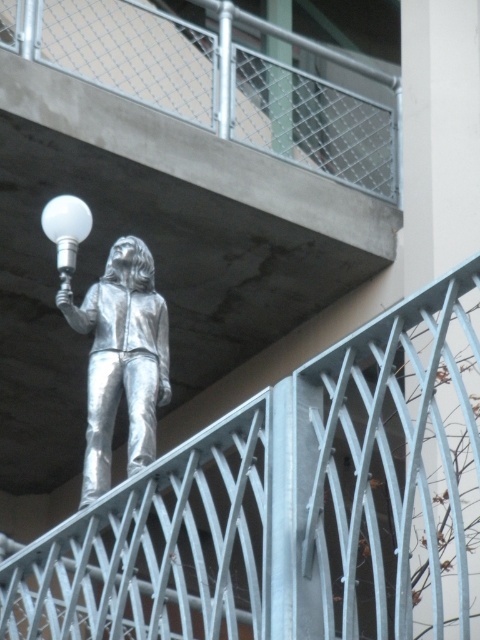
Is point (156, 22) behind point (121, 356)?

Yes, it is behind point (121, 356).

How much distance is there between brushed metal balcony at upper center and shiny silver figure at upper center?

They are 16.84 meters apart.

Locate an element on the screen. brushed metal balcony at upper center is located at coordinates (313, 115).

Between shiny silver figure at upper center and white glossy bulb at upper center, which one appears on the left side from the viewer's perspective?

white glossy bulb at upper center

What do you see at coordinates (121, 358) in the screenshot?
I see `shiny silver figure at upper center` at bounding box center [121, 358].

The height and width of the screenshot is (640, 480). What do you see at coordinates (121, 358) in the screenshot?
I see `shiny silver figure at upper center` at bounding box center [121, 358].

This screenshot has height=640, width=480. In order to click on shiny silver figure at upper center in this screenshot , I will do `click(121, 358)`.

Can you confirm if brushed metal railing at upper center is positioned below white glossy bulb at upper center?

Indeed, brushed metal railing at upper center is positioned under white glossy bulb at upper center.

Which is in front, point (433, 627) or point (59, 227)?

Point (433, 627)

Identify the location of brushed metal railing at upper center. This screenshot has width=480, height=640. (292, 506).